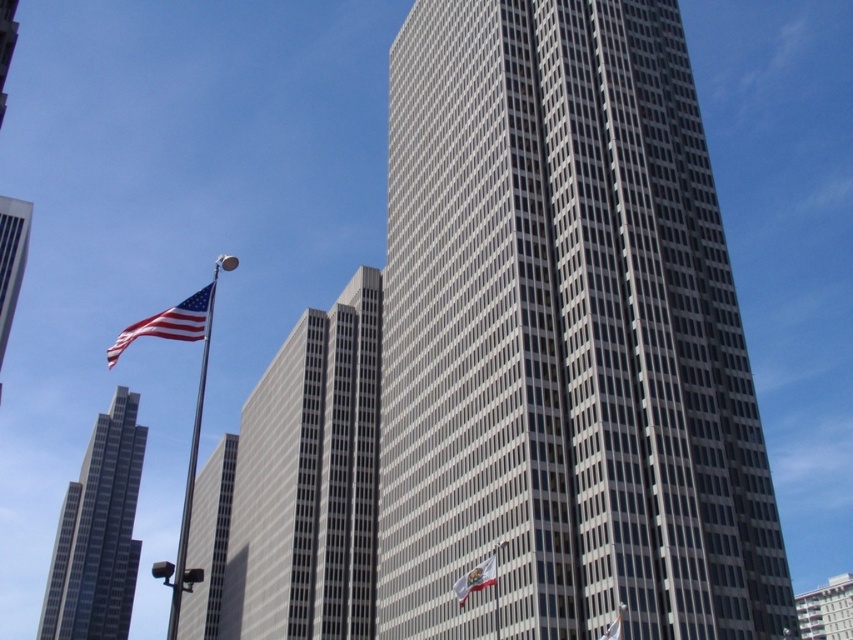
Question: Is gray/concrete building at center to the left of white fabric flag at center from the viewer's perspective?

Choices:
 (A) yes
 (B) no

Answer: (A)

Question: Does smooth glass skyscraper at left have a larger size compared to silver metallic flag pole at left?

Choices:
 (A) no
 (B) yes

Answer: (A)

Question: Which point appears closest to the camera in this image?

Choices:
 (A) (173, 609)
 (B) (505, 204)
 (C) (457, 579)
 (D) (84, 557)

Answer: (C)

Question: Which of the following is the closest to the observer?

Choices:
 (A) gray/concrete building at center
 (B) silver metallic flag pole at left

Answer: (B)

Question: Which of the following is the farthest from the observer?

Choices:
 (A) (132, 500)
 (B) (413, 448)
 (C) (201, 305)
 (D) (28, 209)

Answer: (A)

Question: In this image, where is metallic silver air vent at left located relative to matte fabric flag at left?

Choices:
 (A) above
 (B) below

Answer: (B)